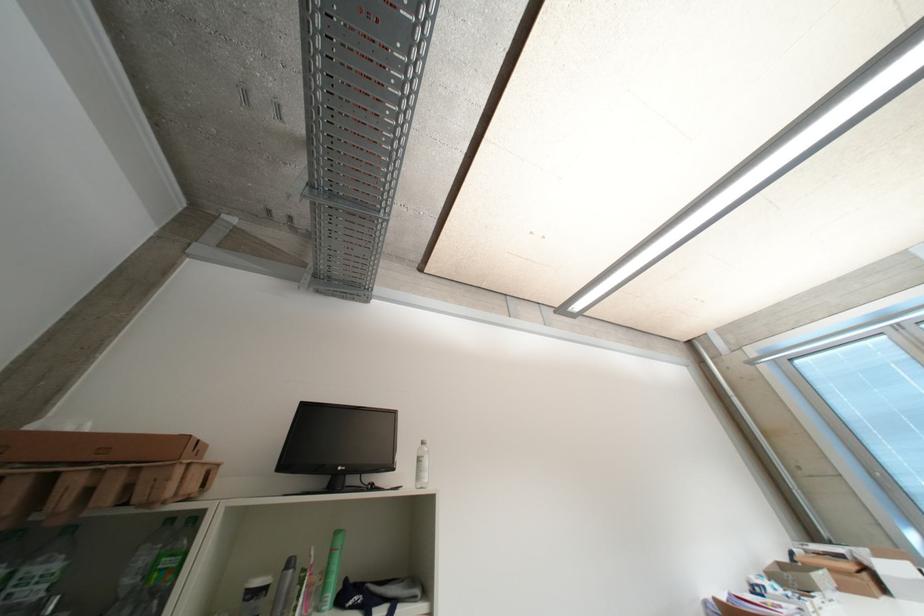
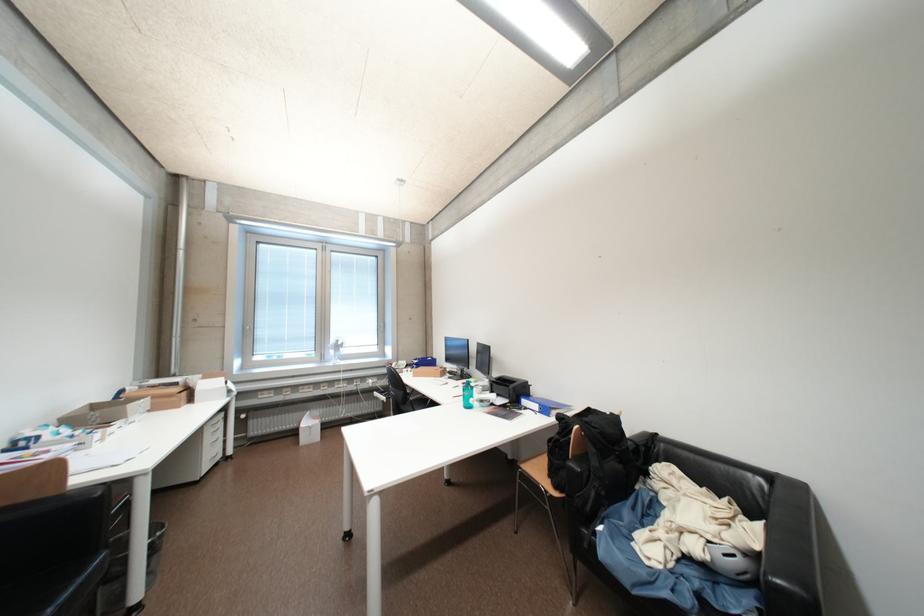
Question: Based on the continuous images, in which direction is the camera rotating? Reply with the corresponding letter.

Choices:
 (A) Left
 (B) Right
 (C) Up
 (D) Down

Answer: (B)